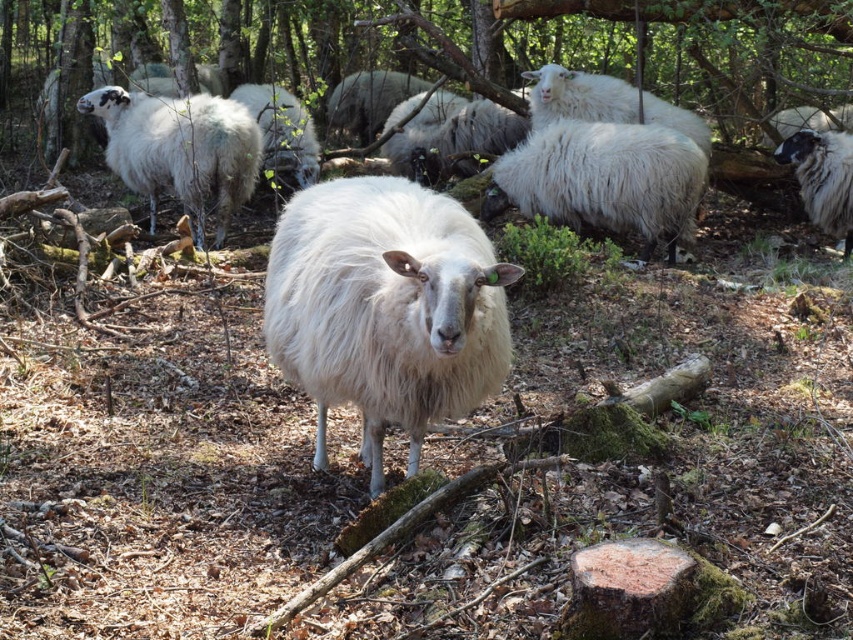
You are standing in the wooded area and want to place a small flag exactly at the point marked by point (x=552, y=44). What object will the flag be placed on?

The flag will be placed on the green mossy log at upper center because point (x=552, y=44) corresponds to that object.

You are a farmer checking the size of your sheep. You notice two sheep in the image, the white fluffy sheep at center and the white fluffy sheep at upper left. Which sheep is wider?

The white fluffy sheep at upper left is wider than the white fluffy sheep at center.

You are a farmer who needs to check on the white fluffy sheep at center and the white fluffy sheep at upper left. If your walking speed is 1.5 meters per second, how many seconds will it take you to walk from one to the other?

The distance between the white fluffy sheep at center and the white fluffy sheep at upper left is 3.98 meters. At a walking speed of 1.5 meters per second, it would take approximately 2.65 seconds to walk between them.